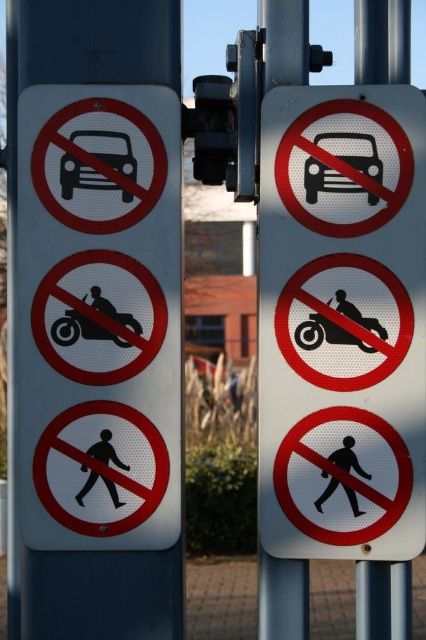
Does metallic pole at center have a smaller size compared to black matte motorcycle at center?

Actually, metallic pole at center might be larger than black matte motorcycle at center.

Locate an element on the screen. The height and width of the screenshot is (640, 426). metallic pole at center is located at coordinates (382, 40).

From the picture: Can you confirm if white plastic sign at center is taller than black textured motorcycle at center?

Yes, white plastic sign at center is taller than black textured motorcycle at center.

Is white plastic sign at center bigger than black textured motorcycle at center?

Yes, white plastic sign at center is bigger than black textured motorcycle at center.

Identify the location of white plastic sign at center. The height and width of the screenshot is (640, 426). (284, 42).

What are the coordinates of `white plastic sign at center` in the screenshot? It's located at (284, 42).

Is metallic silver car at center wider than white plastic sign at center?

Yes, metallic silver car at center is wider than white plastic sign at center.

Which is behind, point (310, 227) or point (279, 80)?

The point (279, 80) is behind.

The image size is (426, 640). In order to click on metallic silver car at center in this screenshot , I will do `click(342, 323)`.

Locate an element on the screen. This screenshot has height=640, width=426. metallic silver car at center is located at coordinates (342, 323).